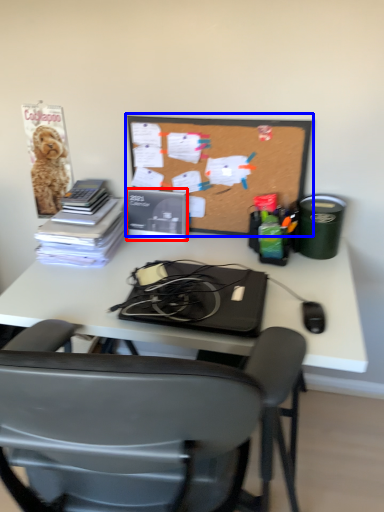
Question: Among these objects, which one is nearest to the camera, paperback book (highlighted by a red box) or bulletin board (highlighted by a blue box)?

Choices:
 (A) paperback book
 (B) bulletin board

Answer: (B)